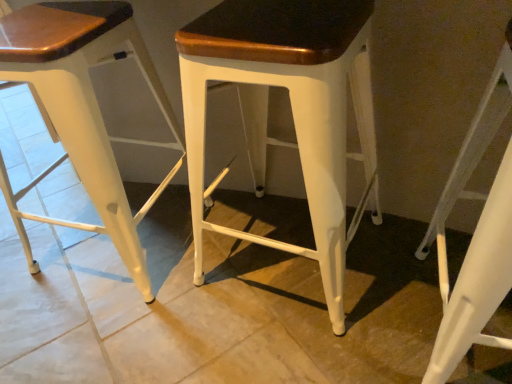
Image resolution: width=512 pixels, height=384 pixels. What are the coordinates of `free spot above white matte stool at center, marked as the 2th stool in a left-to-right arrangement (from a real-world perspective)` in the screenshot? It's located at (276, 19).